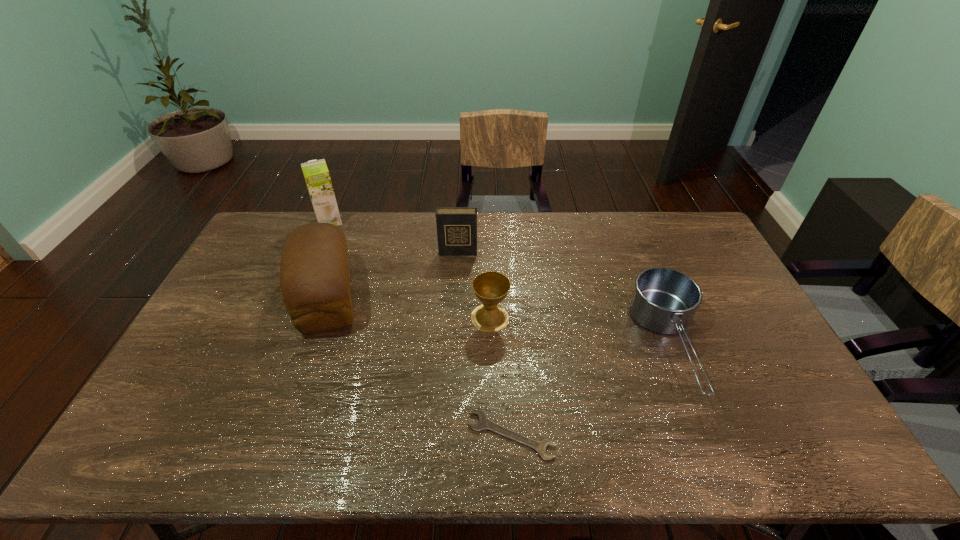
Locate an element on the screen. free space located on the left of the bread is located at coordinates (223, 296).

The width and height of the screenshot is (960, 540). In order to click on vacant region located 0.350m on the front cover of the second farthest object in this screenshot , I will do `click(453, 332)`.

At what (x,y) coordinates should I click in order to perform the action: click on free space located 0.160m on the front of the fourth tallest object. Please return your answer as a coordinate pair (x, y). Image resolution: width=960 pixels, height=540 pixels. Looking at the image, I should click on (492, 379).

You are a GUI agent. You are given a task and a screenshot of the screen. Output one action in this format:
    pyautogui.click(x=<x>, y=<y>)
    Task: Click on the vacant position located 0.390m on the back of the shortest object
    The width and height of the screenshot is (960, 540).
    Given the screenshot: What is the action you would take?
    point(504,300)

You are a GUI agent. You are given a task and a screenshot of the screen. Output one action in this format:
    pyautogui.click(x=<x>, y=<y>)
    Task: Click on the soya milk positioned at the far edge
    The image size is (960, 540).
    Given the screenshot: What is the action you would take?
    pyautogui.click(x=316, y=174)

Identify the location of diary that is at the far edge. This screenshot has height=540, width=960. (456, 226).

You are a GUI agent. You are given a task and a screenshot of the screen. Output one action in this format:
    pyautogui.click(x=<x>, y=<y>)
    Task: Click on the object that is at the near edge
    The image size is (960, 540).
    Given the screenshot: What is the action you would take?
    pyautogui.click(x=484, y=423)

At what (x,y) coordinates should I click in order to perform the action: click on vacant space at the far edge of the desktop. Please return your answer as a coordinate pair (x, y). The width and height of the screenshot is (960, 540). Looking at the image, I should click on (638, 217).

This screenshot has height=540, width=960. In the image, there is a desktop. Find the location of `vacant space at the right edge`. vacant space at the right edge is located at coordinates (779, 377).

Locate an element on the screen. vacant area that lies between the rightmost object and the third tallest object is located at coordinates (564, 299).